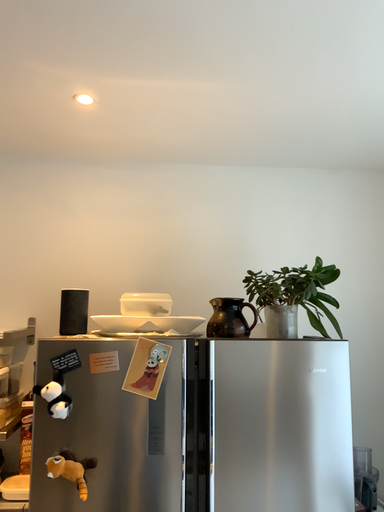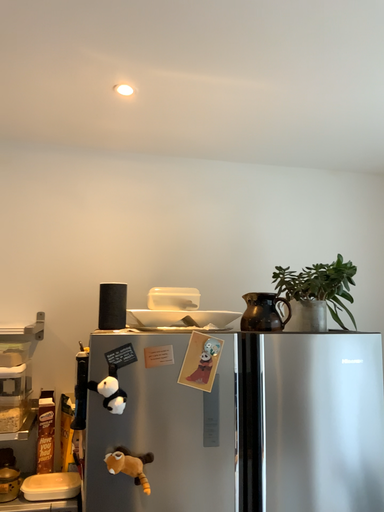
Question: Which way did the camera rotate in the video?

Choices:
 (A) rotated left
 (B) rotated right

Answer: (B)